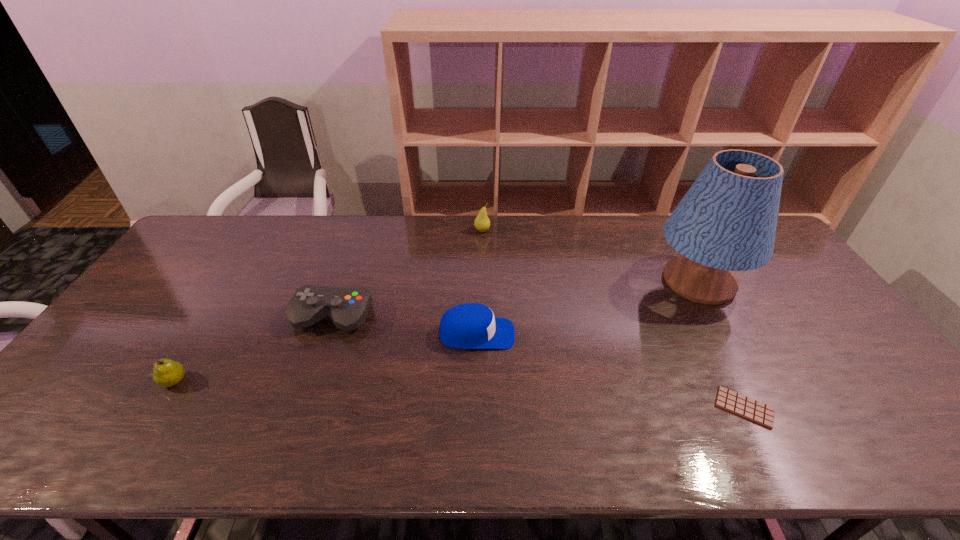
Locate an element on the screen. unoccupied area between the farthest object and the fifth object from right to left is located at coordinates pyautogui.click(x=407, y=274).

This screenshot has width=960, height=540. In order to click on object that is the nearest to the nearer pear in this screenshot , I will do `click(347, 307)`.

Where is `object that is the fourth closest to the second object from left to right`? The image size is (960, 540). object that is the fourth closest to the second object from left to right is located at coordinates (727, 220).

Identify the location of vacant area that satisfies the following two spatial constraints: 1. on the front-facing side of the baseball cap; 2. on the back side of the candy bar. Image resolution: width=960 pixels, height=540 pixels. (476, 408).

This screenshot has width=960, height=540. In order to click on vacant space that satisfies the following two spatial constraints: 1. on the front side of the shortest object; 2. on the left side of the control in this screenshot , I will do 301,408.

Where is `free space in the image that satisfies the following two spatial constraints: 1. on the back side of the leftmost object; 2. on the right side of the taller pear`? The width and height of the screenshot is (960, 540). free space in the image that satisfies the following two spatial constraints: 1. on the back side of the leftmost object; 2. on the right side of the taller pear is located at coordinates (268, 231).